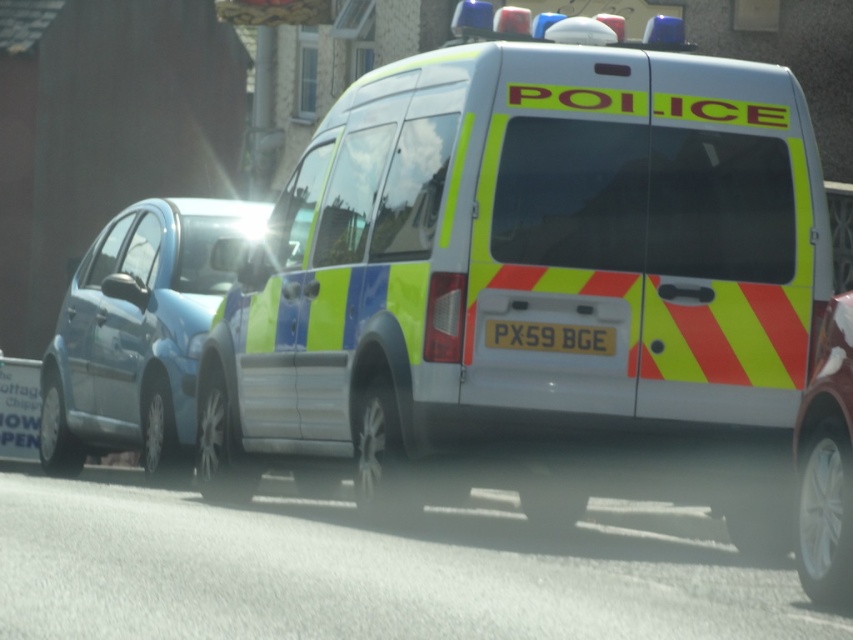
Question: Does reflective yellow and blue van at center have a smaller size compared to shiny silver wheel at lower right?

Choices:
 (A) no
 (B) yes

Answer: (A)

Question: Which of the following is the closest to the observer?

Choices:
 (A) yellow reflective plastic at rear
 (B) reflective yellow and blue van at center
 (C) blue metallic car at left
 (D) shiny silver wheel at lower right

Answer: (D)

Question: Does shiny silver wheel at lower right appear under yellow reflective plastic at rear?

Choices:
 (A) yes
 (B) no

Answer: (A)

Question: Which object is farther from the camera taking this photo?

Choices:
 (A) shiny silver wheel at lower right
 (B) reflective yellow and blue van at center
 (C) blue metallic car at left

Answer: (C)

Question: Considering the real-world distances, which object is farthest from the reflective yellow and blue van at center?

Choices:
 (A) yellow reflective plastic at rear
 (B) blue metallic car at left

Answer: (B)

Question: Does shiny silver wheel at lower right lie behind yellow reflective plastic at rear?

Choices:
 (A) no
 (B) yes

Answer: (A)